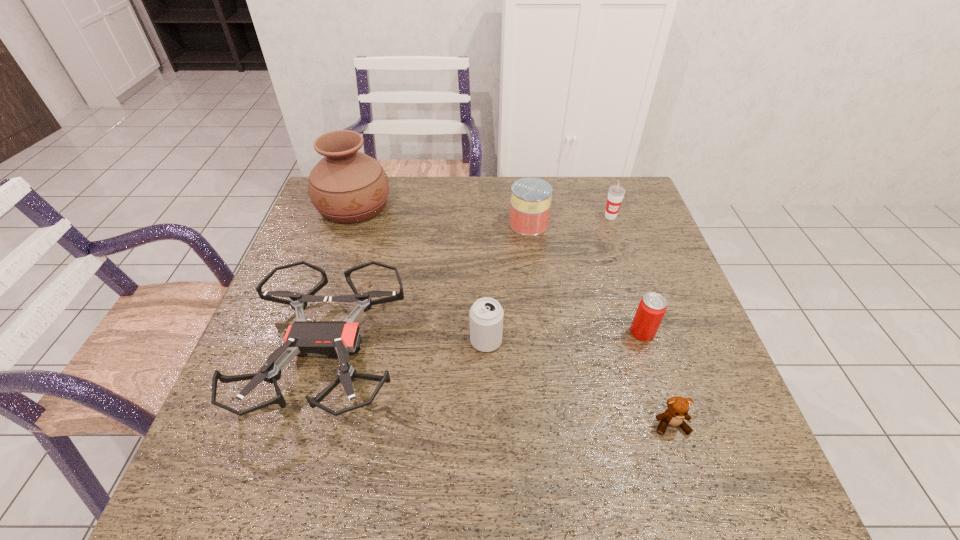
Where is `the tallest object`? The image size is (960, 540). the tallest object is located at coordinates (346, 186).

Image resolution: width=960 pixels, height=540 pixels. I want to click on cup, so click(616, 193).

You are a GUI agent. You are given a task and a screenshot of the screen. Output one action in this format:
    pyautogui.click(x=<x>, y=<y>)
    Task: Click on the fourth object from right to left
    
    Given the screenshot: What is the action you would take?
    pyautogui.click(x=531, y=197)

Where is `the second can from left to right`? This screenshot has width=960, height=540. the second can from left to right is located at coordinates (531, 197).

Where is `the leftmost can`? the leftmost can is located at coordinates (486, 314).

The image size is (960, 540). I want to click on the rightmost can, so click(x=652, y=307).

I want to click on drone, so click(x=335, y=339).

Where is `teddy bear`? The width and height of the screenshot is (960, 540). teddy bear is located at coordinates (678, 407).

I want to click on vacant region located on the right of the urn, so click(x=423, y=206).

Identify the location of vacant space located 0.110m on the side of the cup with the logo. (620, 245).